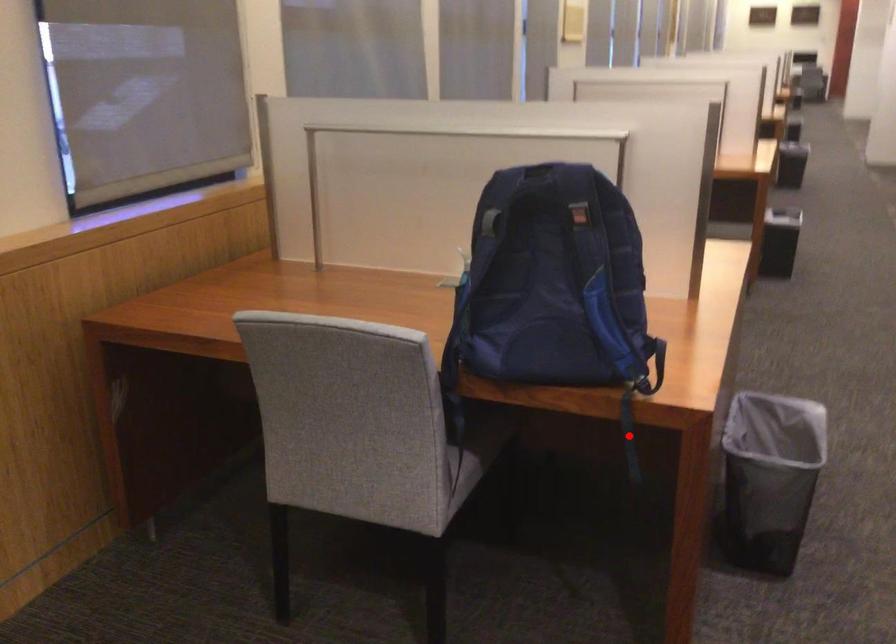
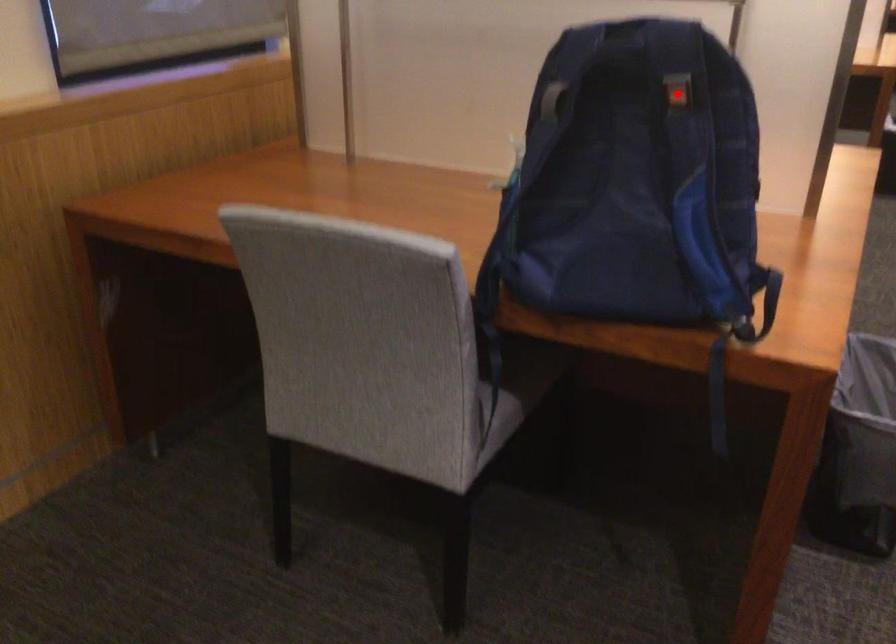
I am providing you with two images of the same scene from different viewpoints. A red point is marked on the first image and another point is marked on the second image. Are the points marked in image1 and image2 representing the same 3D position?

No